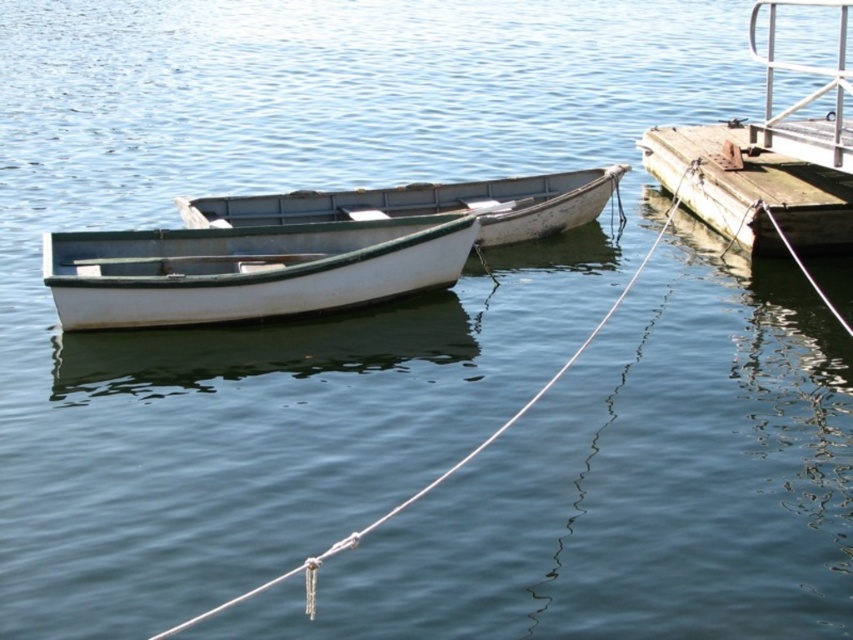
You are standing on the dock and looking down at the water. You notice the rusty wood dock at right and the white rope at center. Which object is closer to you, the observer?

The rusty wood dock at right is located above the white rope at center, so the rusty wood dock at right is closer to you.

You are trying to secure a new rope to the dock. The existing white rope at center is currently tied to the white painted wood boat at center. If you want to attach a new rope that is twice as long as the boat is wide, do you have enough space between the boat and the dock to do so without overlapping?

The white painted wood boat at center might be wider than the white rope at center. However, since the rope is only a line and has negligible width, there is likely enough space to attach a new rope twice the boat width without overlapping.

You are standing on the dock and want to untie the white rope at center. Which boat, the white painted wood boat at center or another boat, is positioned to the left of the rope?

The white painted wood boat at center is positioned to the left of the white rope at center.